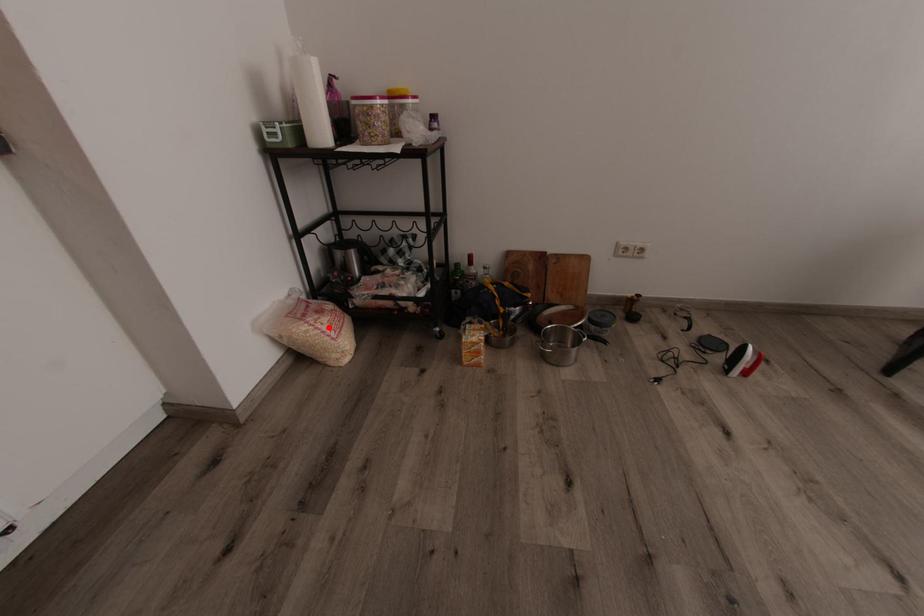
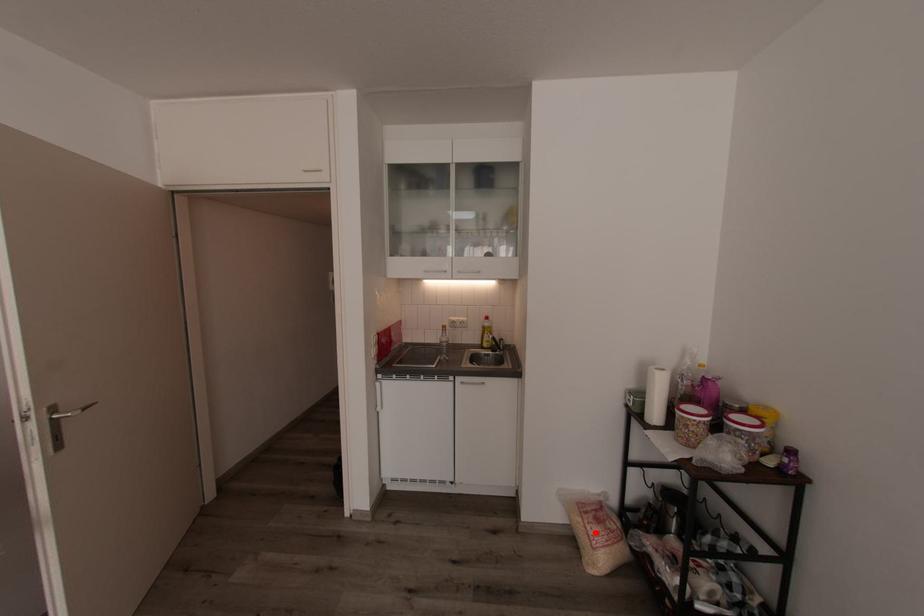
I am providing you with two images of the same scene from different viewpoints. A red point is marked on the first image and another point is marked on the second image. Is the red point in image1 aligned with the point shown in image2?

Yes